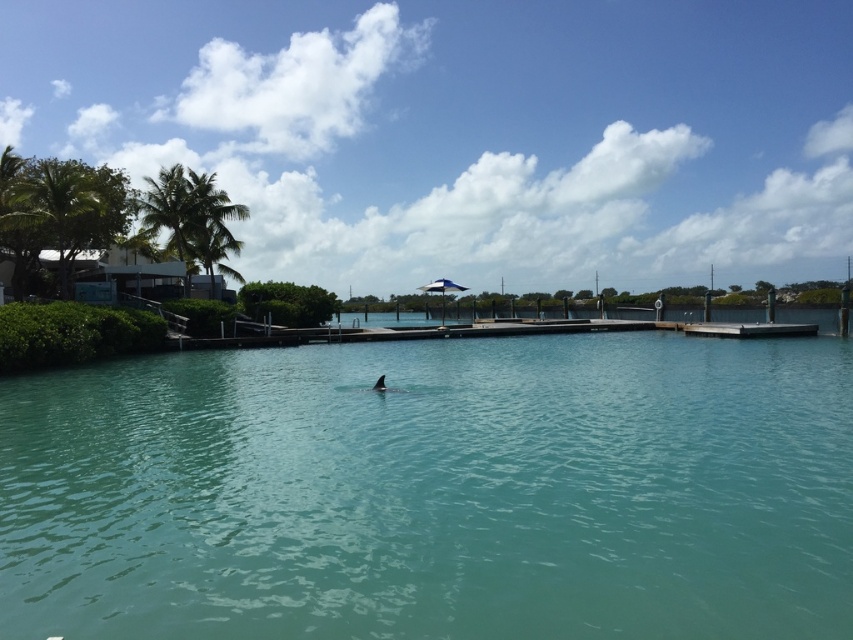
Question: Among these objects, which one is nearest to the camera?

Choices:
 (A) green leafy palm tree at upper left
 (B) green leafy palm tree at left

Answer: (B)

Question: Can you confirm if clear blue water at center is smaller than green leafy palm tree at left?

Choices:
 (A) no
 (B) yes

Answer: (B)

Question: Can you confirm if clear blue water at center is wider than green leafy palm tree at upper left?

Choices:
 (A) no
 (B) yes

Answer: (B)

Question: Is green leafy palm tree at upper left positioned at the back of green leafy palm tree at left?

Choices:
 (A) no
 (B) yes

Answer: (B)

Question: Among these points, which one is farthest from the camera?

Choices:
 (A) (283, 387)
 (B) (48, 196)
 (C) (144, 227)

Answer: (C)

Question: Which point appears closest to the camera in this image?

Choices:
 (A) (137, 204)
 (B) (39, 550)

Answer: (B)